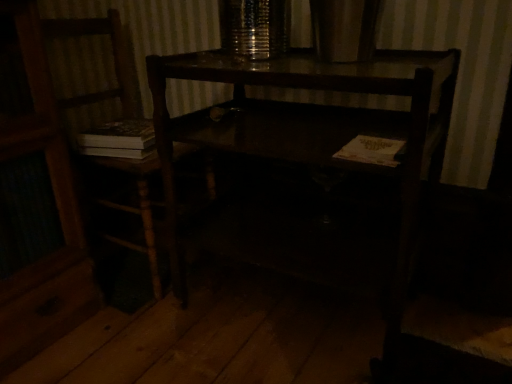
This screenshot has width=512, height=384. What do you see at coordinates (316, 131) in the screenshot?
I see `dark wood desk at center` at bounding box center [316, 131].

I want to click on white paper book at lower right, so click(371, 150).

Does dark wood desk at center contain wooden chair at left?

Definitely not — wooden chair at left is not inside dark wood desk at center.

From a real-world perspective, is dark wood desk at center physically above wooden chair at left?

No.

In the scene shown: In the image, is dark wood desk at center positioned in front of or behind wooden chair at left?

Visually, dark wood desk at center is located in front of wooden chair at left.

Where is `desk directly beneath the wooden chair at left (from a real-world perspective)`? The image size is (512, 384). desk directly beneath the wooden chair at left (from a real-world perspective) is located at coordinates coord(316,131).

Could you tell me if wooden chair at left is facing white paper book at lower right?

Yes, wooden chair at left faces towards white paper book at lower right.

Is wooden chair at left inside the boundaries of white paper book at lower right, or outside?

wooden chair at left exists outside the volume of white paper book at lower right.

Which point is more distant from viewer, [149,227] or [377,159]?

Result: The point [149,227] is farther.

Is dark wood desk at center aimed at white paper book at lower right?

Yes, dark wood desk at center is aimed at white paper book at lower right.

From a real-world perspective, relative to white paper book at lower right, is dark wood desk at center vertically above or below?

In terms of real-world spatial position, dark wood desk at center is below white paper book at lower right.

Measure the distance from dark wood desk at center to white paper book at lower right.

10.03 inches.

Is dark wood desk at center touching white paper book at lower right?

They are not placed beside each other.

Is wooden chair at left positioned beyond the bounds of dark wood desk at center?

Yes, wooden chair at left is located beyond the bounds of dark wood desk at center.

Between wooden chair at left and dark wood desk at center, which one is positioned behind?

Positioned behind is wooden chair at left.

Identify the location of desk below the wooden chair at left (from the image's perspective). This screenshot has height=384, width=512. (316, 131).

Between white paper book at lower right and dark wood desk at center, which one has smaller size?

Smaller between the two is white paper book at lower right.

What's the angular difference between white paper book at lower right and dark wood desk at center's facing directions?

1.1 degrees separate the facing orientations of white paper book at lower right and dark wood desk at center.

Does white paper book at lower right appear on the left side of dark wood desk at center?

No, white paper book at lower right is not to the left of dark wood desk at center.

Is white paper book at lower right in contact with dark wood desk at center?

white paper book at lower right and dark wood desk at center are clearly separated.

In the scene shown: Does white paper book at lower right have a larger size compared to wooden chair at left?

No, white paper book at lower right is not bigger than wooden chair at left.

Consider the image. Is white paper book at lower right taller or shorter than wooden chair at left?

In the image, white paper book at lower right appears to be shorter than wooden chair at left.

Which point is more forward, (389, 140) or (60, 105)?

The point (389, 140) is in front.

Would you say white paper book at lower right is outside wooden chair at left?

Indeed, white paper book at lower right is completely outside wooden chair at left.

Locate an element on the screen. The height and width of the screenshot is (384, 512). chair lying behind the dark wood desk at center is located at coordinates (114, 60).

Image resolution: width=512 pixels, height=384 pixels. In order to click on book located on the right of wooden chair at left in this screenshot , I will do `click(371, 150)`.

From the image, which object appears to be nearer to white paper book at lower right, dark wood desk at center or wooden chair at left?

dark wood desk at center lies closer to white paper book at lower right than the other object.

When comparing their distances from dark wood desk at center, does white paper book at lower right or wooden chair at left seem further?

wooden chair at left is further to dark wood desk at center.

Based on their spatial positions, is wooden chair at left or white paper book at lower right further from dark wood desk at center?

wooden chair at left.

Based on their spatial positions, is white paper book at lower right or dark wood desk at center further from wooden chair at left?

Based on the image, white paper book at lower right appears to be further to wooden chair at left.

Which object lies further to the anchor point white paper book at lower right, wooden chair at left or dark wood desk at center?

Based on the image, wooden chair at left appears to be further to white paper book at lower right.

Looking at the image, which one is located closer to wooden chair at left, dark wood desk at center or white paper book at lower right?

The object closer to wooden chair at left is dark wood desk at center.

Find the location of a particular element. desk between wooden chair at left and white paper book at lower right in the horizontal direction is located at coordinates pos(316,131).